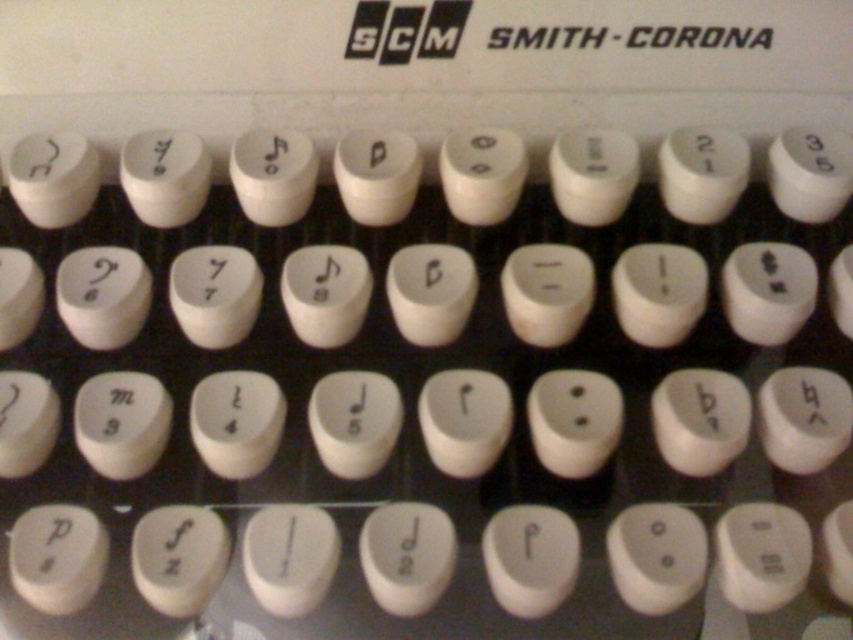
You are a typewriter repair technician examining the SCM Smith Corona typewriter. You notice the black plastic text at upper center and the white plastic key at center. Which object is closer to you?

The black plastic text at upper center is closer to you because the white plastic key at center is behind it.